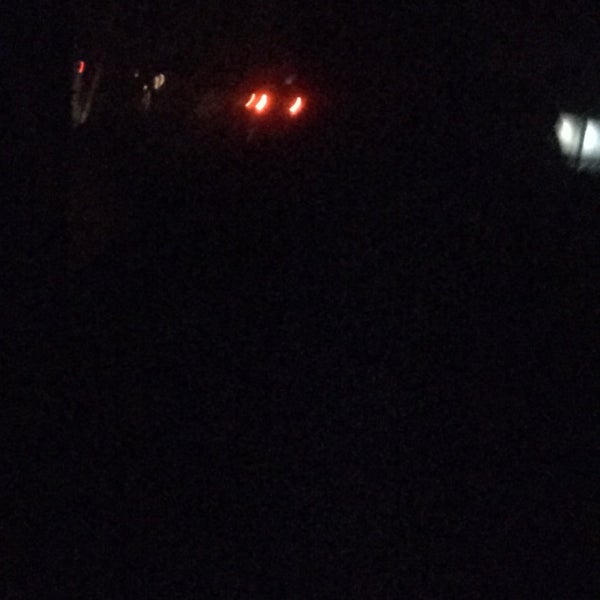
Where is `left side light`? left side light is located at coordinates (249, 99).